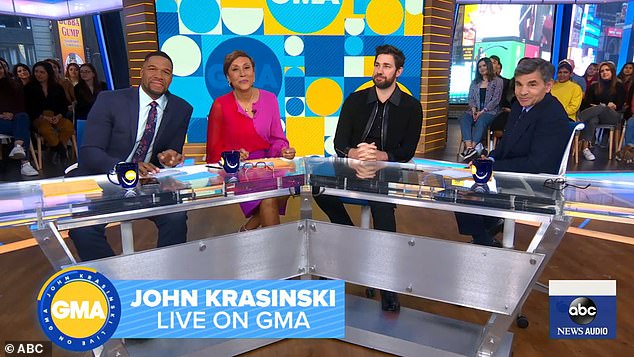
Find the location of a particular element. The width and height of the screenshot is (634, 357). wood floor is located at coordinates (579, 251).